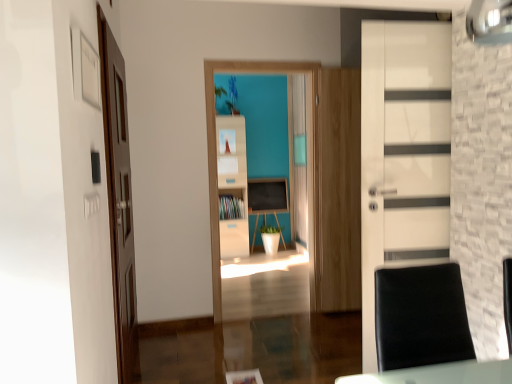
The image size is (512, 384). Describe the element at coordinates (420, 317) in the screenshot. I see `black leather swivel chair at lower right` at that location.

At what (x,y) coordinates should I click in order to perform the action: click on white wood bookshelf at center. Please return your answer as a coordinate pair (x, y). The image size is (512, 384). Looking at the image, I should click on (233, 184).

Describe the element at coordinates (229, 95) in the screenshot. This screenshot has width=512, height=384. I see `green matte plant at center` at that location.

Where is `white matte bookshelf at center`? This screenshot has height=384, width=512. white matte bookshelf at center is located at coordinates (216, 157).

Based on the photo, in order to face matte black chalkboard at center, should I rotate leftwards or rightwards?

You should rotate right by 1.471 degrees.

The width and height of the screenshot is (512, 384). What are the coordinates of `brown wooden door at left, which is counted as the 1th door, starting from the left` in the screenshot? It's located at (119, 199).

The height and width of the screenshot is (384, 512). Find the location of `swivel chair below the green matte plant at center (from a real-world perspective)`. swivel chair below the green matte plant at center (from a real-world perspective) is located at coordinates (420, 317).

In the scene shown: From a real-world perspective, which is physically above, black leather swivel chair at lower right or green matte plant at center?

From a 3D spatial view, green matte plant at center is above.

Can you confirm if black leather swivel chair at lower right is positioned to the left of green matte plant at center?

Incorrect, black leather swivel chair at lower right is not on the left side of green matte plant at center.

Does black leather swivel chair at lower right turn towards green matte plant at center?

No, black leather swivel chair at lower right does not turn towards green matte plant at center.

From the image's perspective, between matte wood cabinet at center and white wood bookshelf at center, who is located below?

From the image's view, matte wood cabinet at center is below.

Consider the image. Is matte wood cabinet at center situated inside white wood bookshelf at center or outside?

matte wood cabinet at center is contained in white wood bookshelf at center.

Is matte wood cabinet at center oriented away from white wood bookshelf at center?

Correct, matte wood cabinet at center is looking away from white wood bookshelf at center.

How far apart are matte wood cabinet at center and white wood bookshelf at center?

matte wood cabinet at center and white wood bookshelf at center are 37.64 centimeters apart from each other.

Image resolution: width=512 pixels, height=384 pixels. What are the coordinates of `computer desk behind the white wood bookshelf at center` in the screenshot? It's located at (267, 199).

Between white wood bookshelf at center and matte black chalkboard at center, which one has larger size?

Bigger between the two is white wood bookshelf at center.

Which object is positioned more to the right, white wood bookshelf at center or matte black chalkboard at center?

matte black chalkboard at center is more to the right.

Is white wood bookshelf at center positioned beyond the bounds of matte black chalkboard at center?

That's correct, white wood bookshelf at center is outside of matte black chalkboard at center.

Based on the photo, is matte black chalkboard at center taller or shorter than black leather swivel chair at lower right?

matte black chalkboard at center is taller than black leather swivel chair at lower right.

Is matte black chalkboard at center oriented towards black leather swivel chair at lower right?

Yes, matte black chalkboard at center is facing black leather swivel chair at lower right.

From a real-world perspective, is matte black chalkboard at center positioned above or below black leather swivel chair at lower right?

Clearly, from a real-world perspective, matte black chalkboard at center is below black leather swivel chair at lower right.

Which point is more distant from viewer, (276, 211) or (440, 359)?

The point (276, 211) is farther from the camera.

Considering the sizes of matte black chalkboard at center and green matte plant at center in the image, is matte black chalkboard at center taller or shorter than green matte plant at center?

Considering their sizes, matte black chalkboard at center has more height than green matte plant at center.

Are matte black chalkboard at center and green matte plant at center located far from each other?

Yes, matte black chalkboard at center is far from green matte plant at center.

Does matte black chalkboard at center have a lesser width compared to green matte plant at center?

Yes.

Considering the positions of objects matte black chalkboard at center and green matte plant at center in the image provided, who is behind, matte black chalkboard at center or green matte plant at center?

matte black chalkboard at center is further from the camera.

Does white glossy door at right, the second door when ordered from left to right, have a larger size compared to matte wood cabinet at center?

Yes.

Can you confirm if white glossy door at right, the second door when ordered from left to right, is taller than matte wood cabinet at center?

Yes, white glossy door at right, the second door when ordered from left to right, is taller than matte wood cabinet at center.

Based on their positions, is white glossy door at right, which is counted as the 1th door, starting from the right, located to the left or right of matte wood cabinet at center?

A: Clearly, white glossy door at right, which is counted as the 1th door, starting from the right, is on the right of matte wood cabinet at center in the image.

Is there a large distance between white glossy door at right, the second door when ordered from left to right, and matte wood cabinet at center?

Yes.

Choose the correct answer: Is white glossy door at right, the second door when ordered from left to right, inside matte black chalkboard at center or outside it?

white glossy door at right, the second door when ordered from left to right, is located beyond the bounds of matte black chalkboard at center.

Between white glossy door at right, which is counted as the 1th door, starting from the right, and matte black chalkboard at center, which one is positioned behind?

Positioned behind is matte black chalkboard at center.

Where is `computer desk that appears behind the white glossy door at right, which is counted as the 1th door, starting from the right`? computer desk that appears behind the white glossy door at right, which is counted as the 1th door, starting from the right is located at coordinates [x=267, y=199].

Does white glossy door at right, the second door when ordered from left to right, turn towards matte black chalkboard at center?

Yes, white glossy door at right, the second door when ordered from left to right, faces towards matte black chalkboard at center.

Locate an element on the screen. This screenshot has height=384, width=512. plant behind the black leather swivel chair at lower right is located at coordinates (229, 95).

Locate an element on the screen. The height and width of the screenshot is (384, 512). cabinetry on the right of matte wood cabinet at center is located at coordinates (233, 184).

Based on their spatial positions, is matte black chalkboard at center or white wood bookshelf at center closer to brown wooden door at left, which is counted as the 1th door, starting from the left?

white wood bookshelf at center lies closer to brown wooden door at left, which is counted as the 1th door, starting from the left, than the other object.

Considering their positions, is white glossy door at right, which is counted as the 1th door, starting from the right, positioned closer to black leather swivel chair at lower right than matte black chalkboard at center?

white glossy door at right, which is counted as the 1th door, starting from the right, lies closer to black leather swivel chair at lower right than the other object.

Looking at the image, which one is located further to white matte bookshelf at center, black leather swivel chair at lower right or matte wood cabinet at center?

Based on the image, matte wood cabinet at center appears to be further to white matte bookshelf at center.

When comparing their distances from black leather swivel chair at lower right, does white wood bookshelf at center or matte wood cabinet at center seem further?

matte wood cabinet at center is further to black leather swivel chair at lower right.

Estimate the real-world distances between objects in this image. Which object is further from matte black chalkboard at center, white glossy door at right, which is counted as the 1th door, starting from the right, or green matte plant at center?

white glossy door at right, which is counted as the 1th door, starting from the right, is positioned further to the anchor matte black chalkboard at center.

Considering their positions, is white glossy door at right, the second door when ordered from left to right, positioned further to white wood bookshelf at center than matte black chalkboard at center?

white glossy door at right, the second door when ordered from left to right, lies further to white wood bookshelf at center than the other object.

Which object lies further to the anchor point black leather swivel chair at lower right, matte wood cabinet at center or white glossy door at right, which is counted as the 1th door, starting from the right?

matte wood cabinet at center.

When comparing their distances from black leather swivel chair at lower right, does white wood bookshelf at center or white matte bookshelf at center seem further?

Among the two, white wood bookshelf at center is located further to black leather swivel chair at lower right.

What are the coordinates of `plant located between white glossy door at right, the second door when ordered from left to right, and white wood bookshelf at center in the depth direction` in the screenshot? It's located at (229, 95).

Where is `plant between white matte bookshelf at center and matte black chalkboard at center along the z-axis`? This screenshot has height=384, width=512. plant between white matte bookshelf at center and matte black chalkboard at center along the z-axis is located at coordinates (229, 95).

Find the location of a particular element. The image size is (512, 384). plant between black leather swivel chair at lower right and matte wood cabinet at center from front to back is located at coordinates (229, 95).

Find the location of a particular element. The height and width of the screenshot is (384, 512). door between brown wooden door at left, which is counted as the 1th door, starting from the left, and matte wood cabinet at center in the front-back direction is located at coordinates (403, 153).